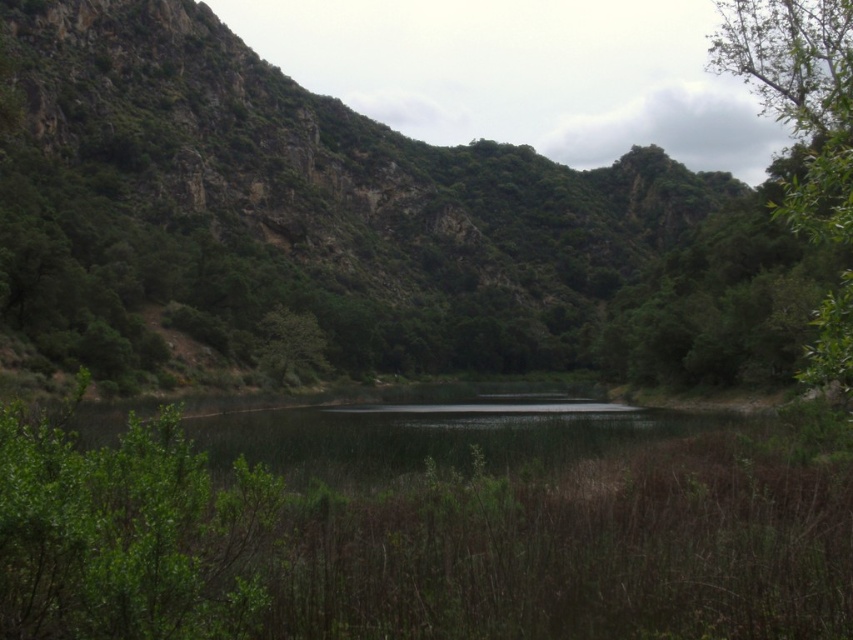
Question: Which object appears closest to the camera in this image?

Choices:
 (A) green leafy bush at center
 (B) green leafy tree at right
 (C) green leafy tree at center

Answer: (A)

Question: Observing the image, what is the correct spatial positioning of green leafy bush at center in reference to green leafy tree at right?

Choices:
 (A) below
 (B) above

Answer: (A)

Question: Which is farther from the green leafy bush at center?

Choices:
 (A) green leafy tree at right
 (B) green leafy tree at center

Answer: (B)

Question: Is green leafy bush at center below green leafy tree at right?

Choices:
 (A) no
 (B) yes

Answer: (B)

Question: Does green leafy tree at right appear over green leafy tree at center?

Choices:
 (A) no
 (B) yes

Answer: (B)

Question: Which of the following is the farthest from the observer?

Choices:
 (A) (315, 320)
 (B) (724, 70)

Answer: (B)